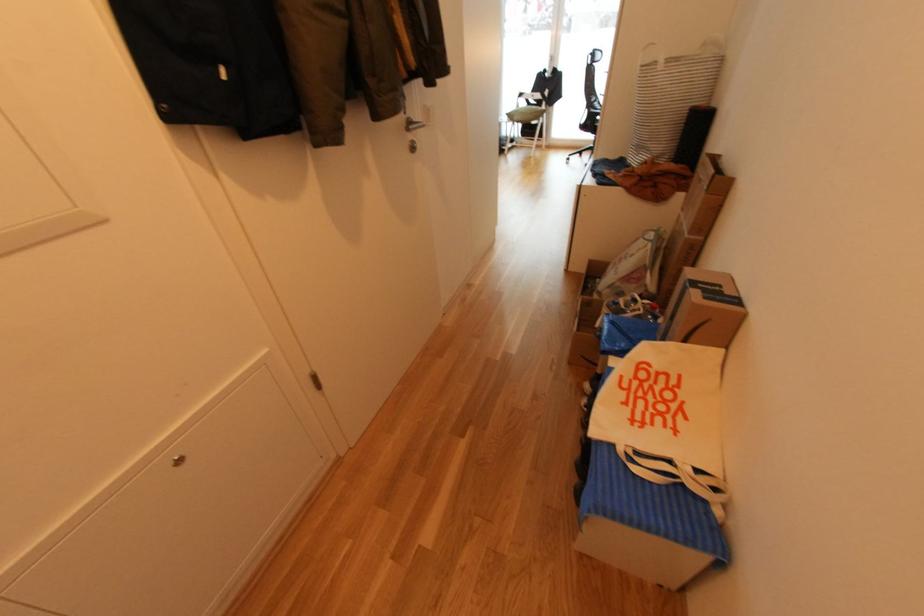
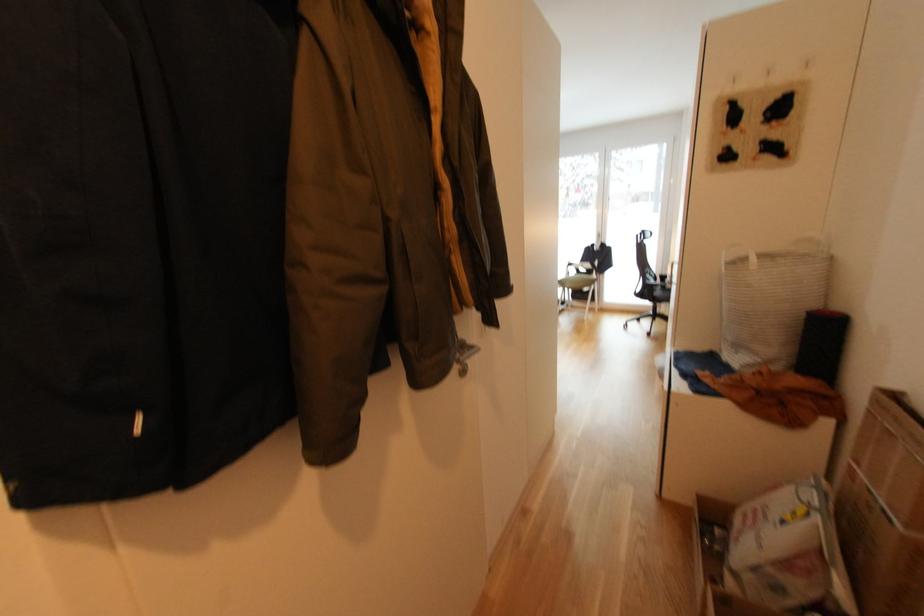
Question: How did the camera likely rotate?

Choices:
 (A) Left
 (B) Right
 (C) Up
 (D) Down

Answer: (C)